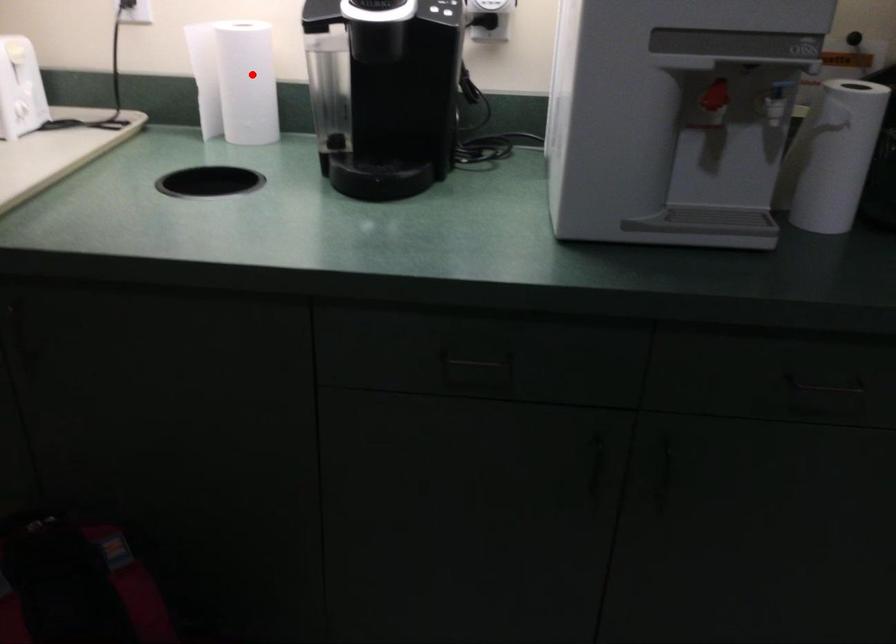
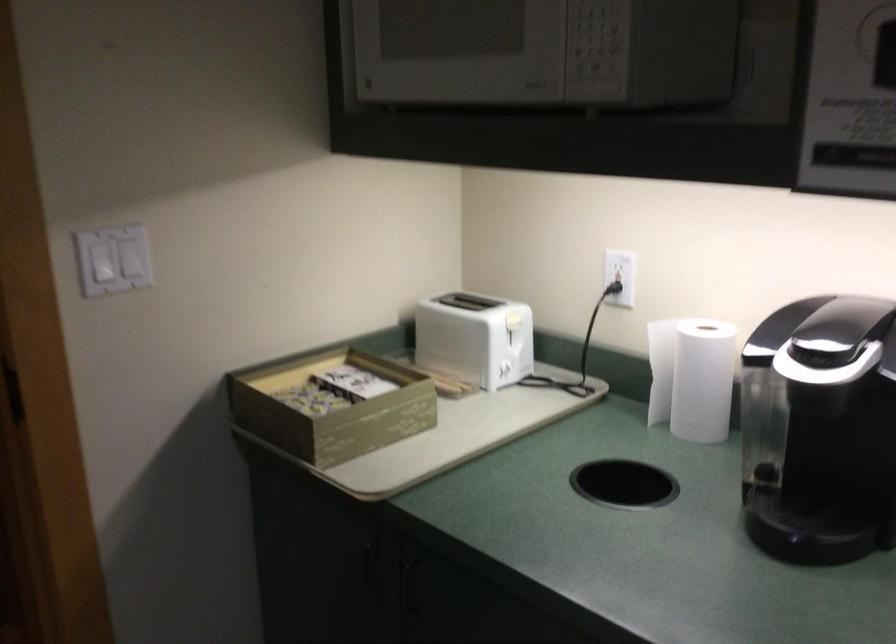
Where in the second image is the point corresponding to the highlighted location from the first image?

(702, 380)